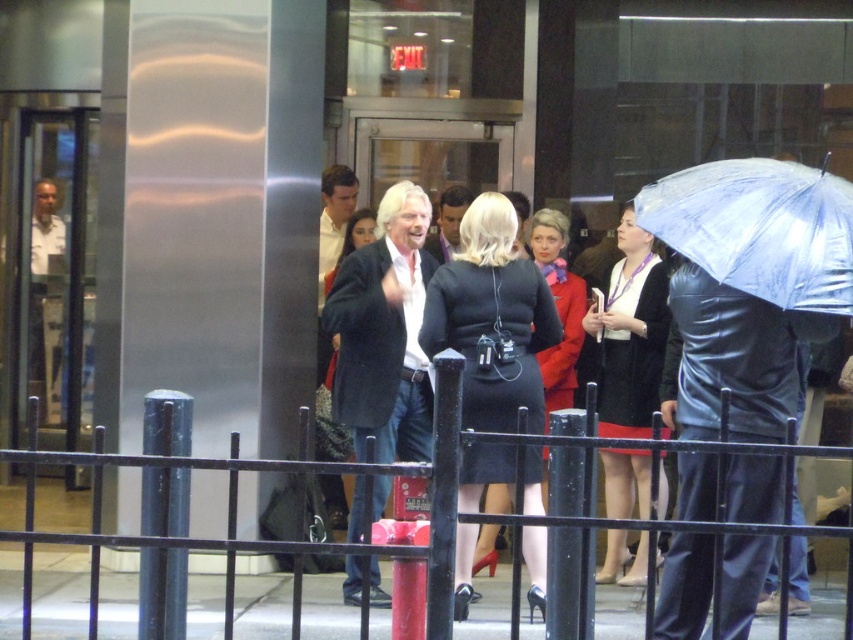
Can you confirm if black fabric dress at center is positioned to the left of black metal fence at lower center?

In fact, black fabric dress at center is to the right of black metal fence at lower center.

This screenshot has width=853, height=640. Find the location of `black fabric dress at center`. black fabric dress at center is located at coordinates (492, 320).

Can you confirm if black metal fence at lower center is thinner than velvet black coat at center?

Incorrect, black metal fence at lower center's width is not less than velvet black coat at center's.

Is point (399, 467) closer to camera compared to point (608, 355)?

Yes, it is.

Image resolution: width=853 pixels, height=640 pixels. Find the location of `black metal fence at lower center`. black metal fence at lower center is located at coordinates (326, 544).

Which is below, black fabric dress at center or transparent plastic umbrella at right?

Positioned lower is black fabric dress at center.

Between black fabric dress at center and transparent plastic umbrella at right, which one has less height?

transparent plastic umbrella at right is shorter.

Is point (521, 464) closer to camera compared to point (703, 237)?

Yes, it is in front of point (703, 237).

Find the location of `black fabric dress at center`. black fabric dress at center is located at coordinates (492, 320).